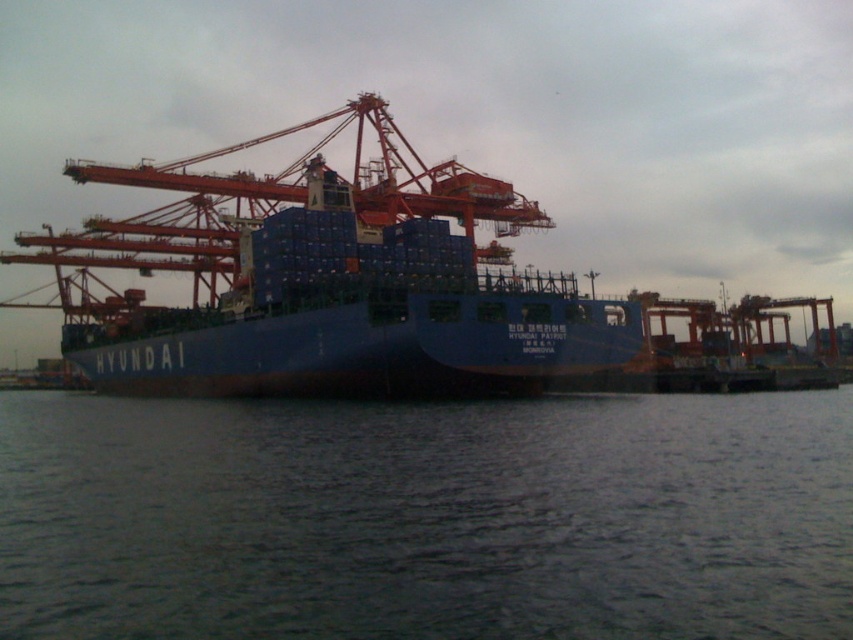
Question: Which object is closer to the camera taking this photo?

Choices:
 (A) metallic orange crane at center
 (B) dark gray water at center
 (C) blue matte container ship at center

Answer: (B)

Question: Is blue matte container ship at center bigger than metallic orange crane at center?

Choices:
 (A) no
 (B) yes

Answer: (A)

Question: Which object is farther from the camera taking this photo?

Choices:
 (A) metallic orange crane at center
 (B) blue matte container ship at center
 (C) dark gray water at center

Answer: (A)

Question: Is the position of dark gray water at center less distant than that of metallic orange crane at center?

Choices:
 (A) no
 (B) yes

Answer: (B)

Question: Can you confirm if dark gray water at center is smaller than metallic orange crane at center?

Choices:
 (A) no
 (B) yes

Answer: (B)

Question: Which is farther from the blue matte container ship at center?

Choices:
 (A) metallic orange crane at center
 (B) dark gray water at center

Answer: (B)